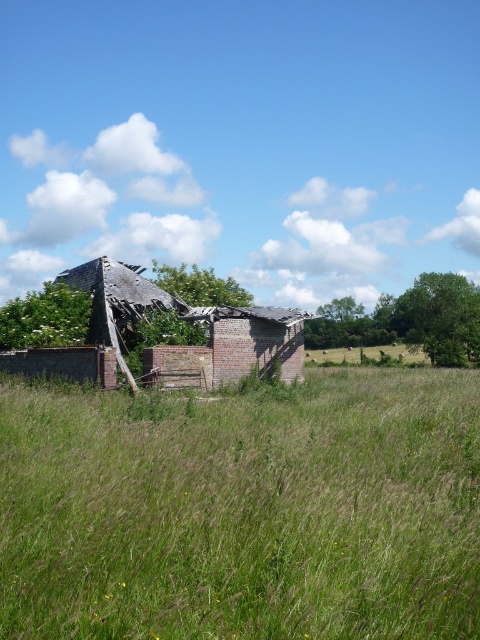
Question: Can you confirm if green grass at center is bigger than brick at center?

Choices:
 (A) no
 (B) yes

Answer: (A)

Question: Which of the following is the farthest from the observer?

Choices:
 (A) (208, 353)
 (B) (151, 442)

Answer: (A)

Question: Can you confirm if green grass at center is smaller than brick at center?

Choices:
 (A) yes
 (B) no

Answer: (A)

Question: Is green grass at center to the right of brick at center from the viewer's perspective?

Choices:
 (A) no
 (B) yes

Answer: (B)